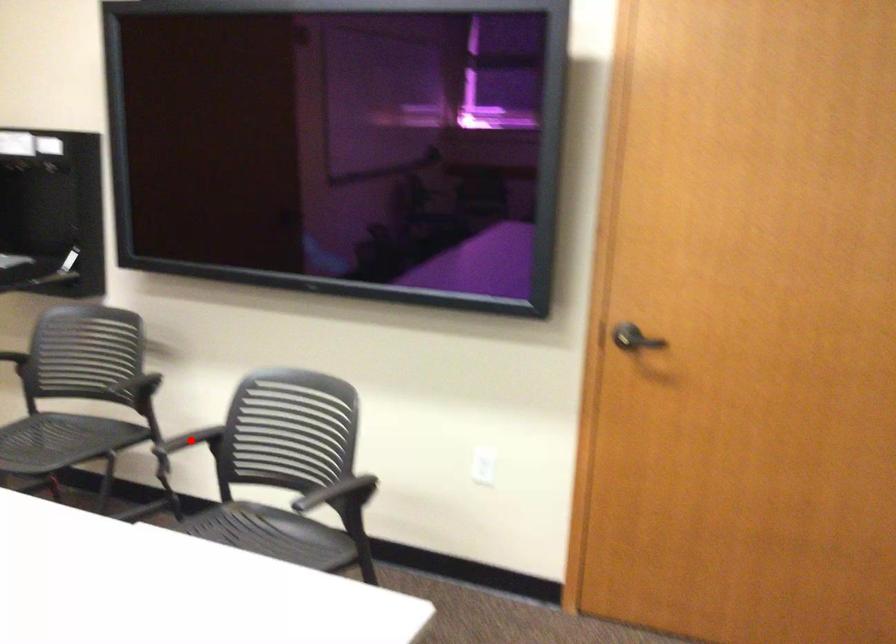
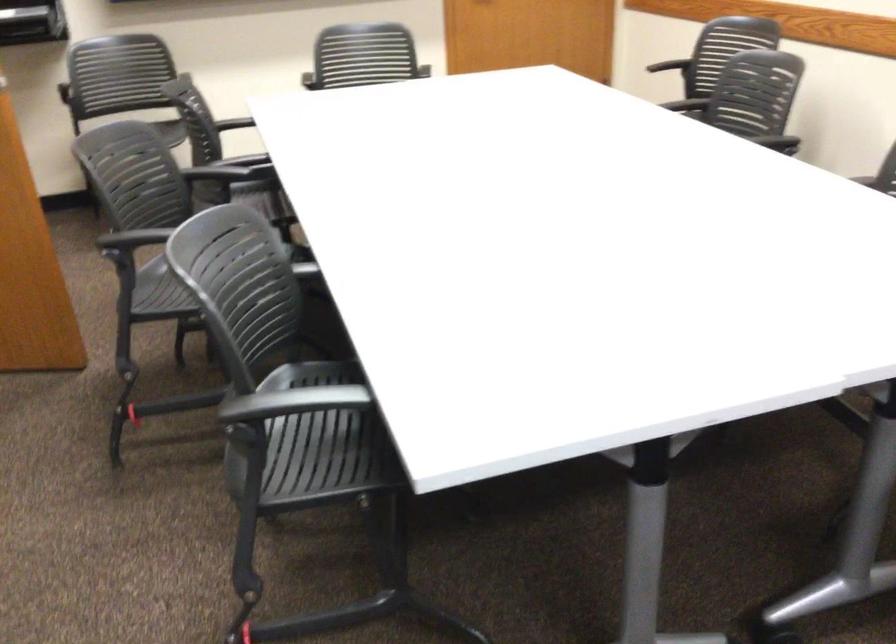
Question: I am providing you with two images of the same scene from different viewpoints. A red point is marked on the first image. At the location where the point appears in image 1, is it still visible in image 2?

Choices:
 (A) Yes
 (B) No

Answer: (B)